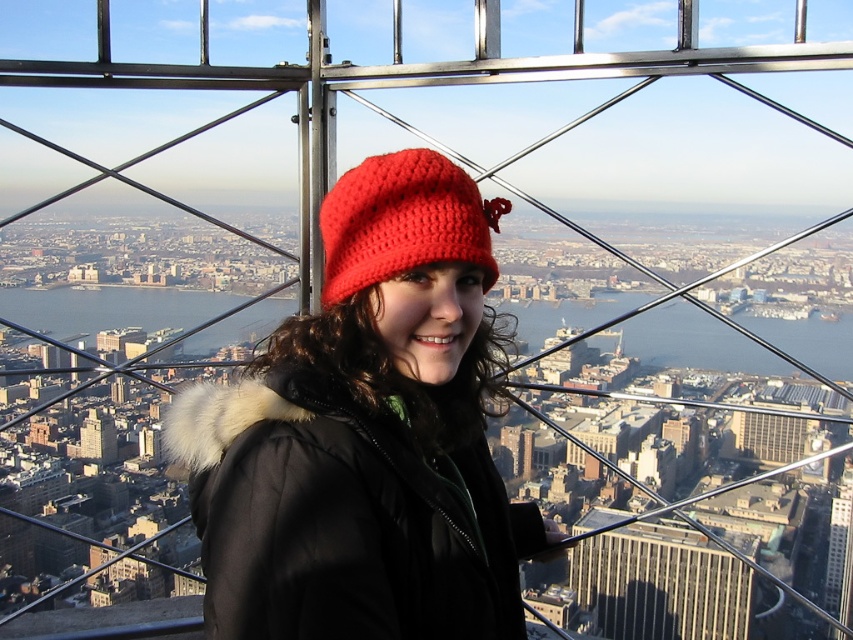
Question: Is crochet knit hat at center smaller than metallic glass skyscraper at center?

Choices:
 (A) yes
 (B) no

Answer: (B)

Question: Which point is farther to the camera?

Choices:
 (A) crochet knit hat at center
 (B) matte beige building at center
 (C) red knitted hat at center

Answer: (B)

Question: Which object is closer to the camera taking this photo?

Choices:
 (A) red knitted hat at center
 (B) crochet knit hat at center
 (C) metallic glass skyscraper at center

Answer: (B)

Question: In this image, where is red knitted hat at center located relative to metallic glass skyscraper at center?

Choices:
 (A) above
 (B) below

Answer: (A)

Question: Which is nearer to the red knitted hat at center?

Choices:
 (A) matte beige building at center
 (B) smooth glass skyscraper at center
 (C) crochet knit hat at center

Answer: (C)

Question: Is the position of red knitted hat at center more distant than that of smooth glass skyscraper at center?

Choices:
 (A) yes
 (B) no

Answer: (B)